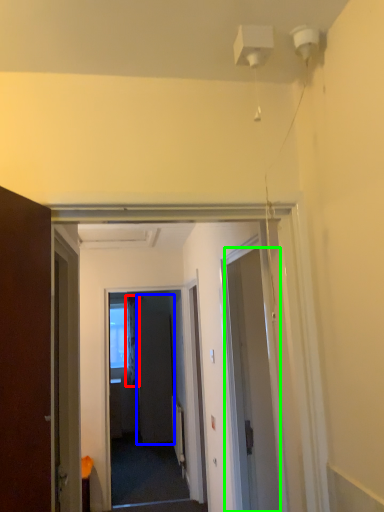
Question: Which object is the closest to the curtain (highlighted by a red box)? Choose among these: screen door (highlighted by a blue box) or door (highlighted by a green box).

Choices:
 (A) screen door
 (B) door

Answer: (A)